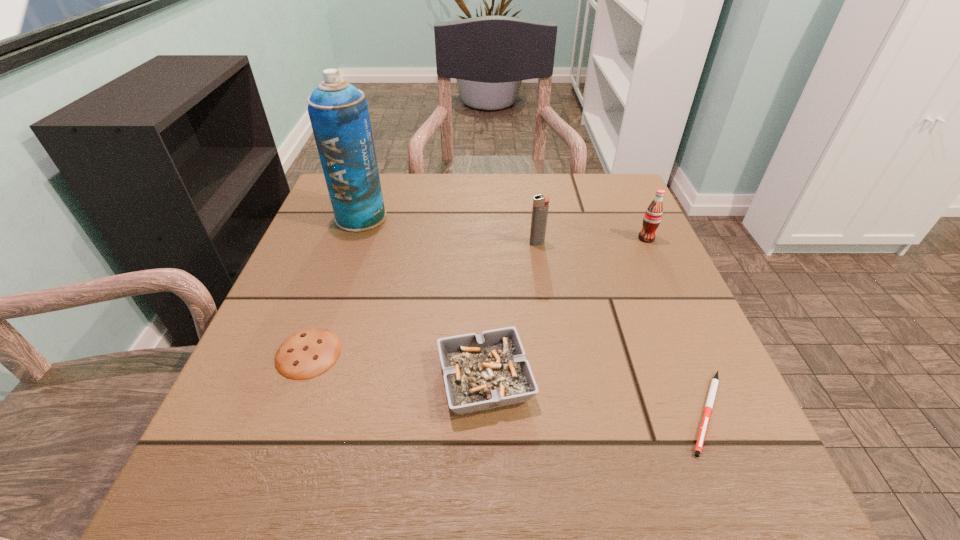
You are a GUI agent. You are given a task and a screenshot of the screen. Output one action in this format:
    pyautogui.click(x=<x>, y=<y>)
    Task: Click on the free space between the cookie and the soda
    The width and height of the screenshot is (960, 540).
    Given the screenshot: What is the action you would take?
    pyautogui.click(x=477, y=296)

I want to click on unoccupied area between the soda and the igniter, so click(591, 241).

This screenshot has height=540, width=960. I want to click on free space that is in between the third object from left to right and the cookie, so click(396, 366).

I want to click on vacant area that lies between the cookie and the farthest object, so 335,285.

Image resolution: width=960 pixels, height=540 pixels. What are the coordinates of `vacant space in between the ashtray and the soda` in the screenshot? It's located at (565, 309).

The image size is (960, 540). I want to click on vacant area that lies between the cookie and the aerosol can, so click(335, 285).

I want to click on vacant space in between the farthest object and the pen, so click(534, 314).

You are a GUI agent. You are given a task and a screenshot of the screen. Output one action in this format:
    pyautogui.click(x=<x>, y=<y>)
    Task: Click on the vacant area that lies between the soda and the cookie
    
    Given the screenshot: What is the action you would take?
    pyautogui.click(x=477, y=296)

Image resolution: width=960 pixels, height=540 pixels. Find the location of `vacant space in between the cookie and the fourth object from left to right`. vacant space in between the cookie and the fourth object from left to right is located at coordinates (422, 298).

Select which object appears as the fifth closest to the fourth object from right to left. Please provide its 2D coordinates. Your answer should be formatted as a tuple, i.e. [(x, y)], where the tuple contains the x and y coordinates of a point satisfying the conditions above.

[(653, 215)]